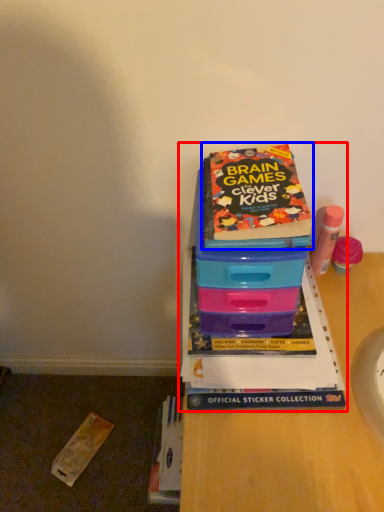
Question: Among these objects, which one is farthest to the camera, book (highlighted by a red box) or book (highlighted by a blue box)?

Choices:
 (A) book
 (B) book

Answer: (A)